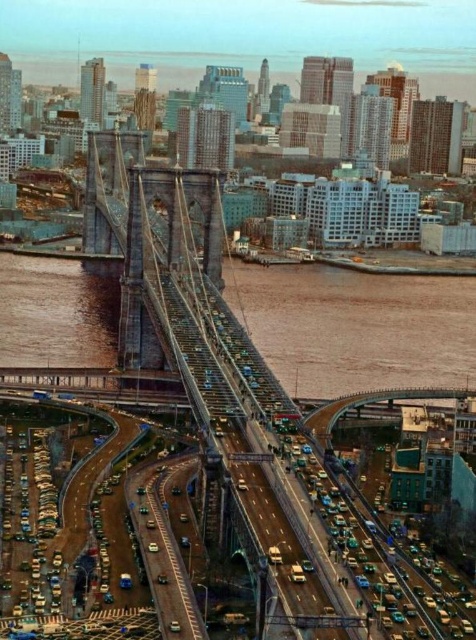
You are a delivery driver navigating through the city and need to cross the gray metallic suspension bridge at center. There is a traffic jam on the bridge. Can you detour around the brown water at center to reach the other side? Explain your reasoning based on their positions.

The gray metallic suspension bridge at center is to the right of brown water at center. Since the bridge is positioned to the right of the water, you can detour around the brown water at center by moving towards the left side of the bridge to bypass the traffic jam and reach the other side.

You are a delivery driver planning to cross the Brooklyn Bridge. You see the gray metallic suspension bridge at center and the brown water at center. Which one is above the other?

The gray metallic suspension bridge at center is positioned over the brown water at center, so the bridge is above the water.

You are a photographer standing on the Brooklyn Bridge and want to capture a photo that includes both the gray metallic suspension bridge at center and the brown water at center. Based on their positions, which object will appear closer to the camera in the photo?

The gray metallic suspension bridge at center is in front of brown water at center, so it will appear closer to the camera in the photo.